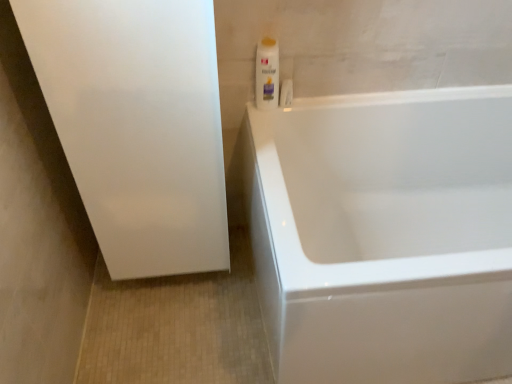
Question: Should I look upward or downward to see white matte screen door at left?

Choices:
 (A) down
 (B) up

Answer: (B)

Question: Is white matte screen door at left in front of white glossy bathtub at right?

Choices:
 (A) yes
 (B) no

Answer: (B)

Question: Can you confirm if white matte screen door at left is shorter than white glossy bathtub at right?

Choices:
 (A) no
 (B) yes

Answer: (A)

Question: Considering the relative positions of white matte screen door at left and white glossy bathtub at right in the image provided, is white matte screen door at left to the right of white glossy bathtub at right from the viewer's perspective?

Choices:
 (A) no
 (B) yes

Answer: (A)

Question: Is white matte screen door at left to the left of white glossy bathtub at right from the viewer's perspective?

Choices:
 (A) yes
 (B) no

Answer: (A)

Question: From the image's perspective, would you say white matte screen door at left is positioned over white glossy bathtub at right?

Choices:
 (A) yes
 (B) no

Answer: (A)

Question: Is white matte screen door at left looking in the opposite direction of white glossy bathtub at right?

Choices:
 (A) no
 (B) yes

Answer: (A)

Question: Can you confirm if white glossy bathtub at right is wider than white matte screen door at left?

Choices:
 (A) no
 (B) yes

Answer: (B)

Question: From the image's perspective, would you say white glossy bathtub at right is positioned over white matte screen door at left?

Choices:
 (A) no
 (B) yes

Answer: (A)

Question: Are white glossy bathtub at right and white matte screen door at left located far from each other?

Choices:
 (A) no
 (B) yes

Answer: (A)

Question: Is white glossy bathtub at right oriented away from white matte screen door at left?

Choices:
 (A) yes
 (B) no

Answer: (B)

Question: Can we say white glossy bathtub at right lies outside white matte screen door at left?

Choices:
 (A) yes
 (B) no

Answer: (A)

Question: Considering the relative sizes of white glossy bathtub at right and white matte screen door at left in the image provided, is white glossy bathtub at right thinner than white matte screen door at left?

Choices:
 (A) no
 (B) yes

Answer: (A)

Question: From the image's perspective, is white plastic bottle at upper right located above white matte screen door at left?

Choices:
 (A) no
 (B) yes

Answer: (B)